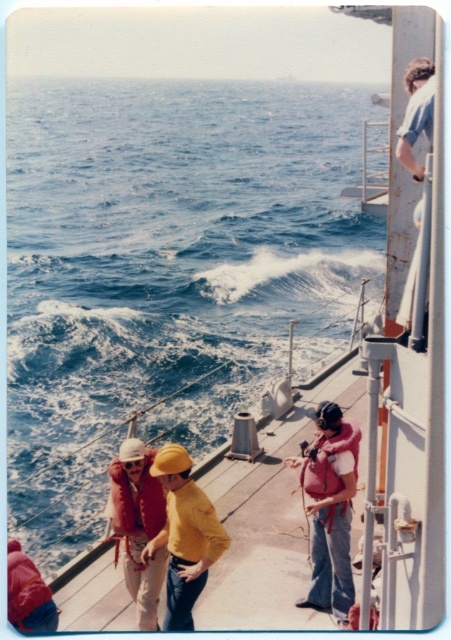
Question: Which object appears farthest from the camera in this image?

Choices:
 (A) matte red life jacket at center
 (B) yellow matte sweater at center
 (C) matte pink life jacket at center
 (D) red life vest at lower left

Answer: (C)

Question: Among these points, which one is farthest from the camera?

Choices:
 (A) (119, 515)
 (B) (331, 488)

Answer: (B)

Question: Does yellow matte sweater at center have a smaller size compared to matte red life vest at lower left?

Choices:
 (A) no
 (B) yes

Answer: (A)

Question: Does red life vest at lower left lie behind matte red life jacket at center?

Choices:
 (A) no
 (B) yes

Answer: (A)

Question: Does matte red life jacket at center appear on the left side of matte red life vest at lower left?

Choices:
 (A) no
 (B) yes

Answer: (A)

Question: Estimate the real-world distances between objects in this image. Which object is farther from the yellow matte sweater at center?

Choices:
 (A) matte red life jacket at center
 (B) matte red life vest at right
 (C) matte red life vest at lower left
 (D) matte pink life jacket at center

Answer: (D)